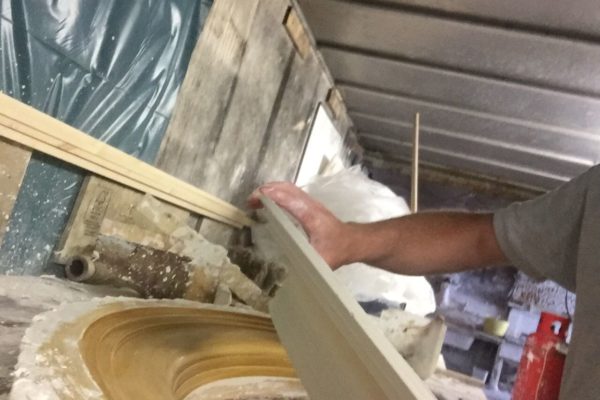
This screenshot has width=600, height=400. What are the coordinates of `ceiling panels` in the screenshot? It's located at (447, 101).